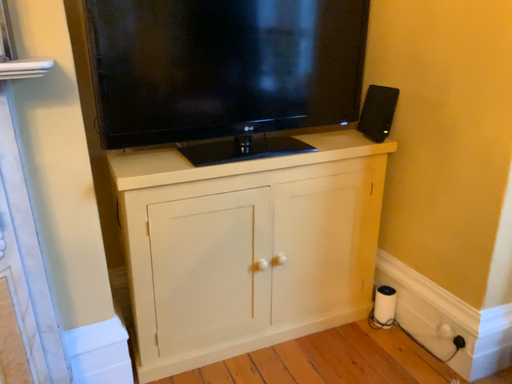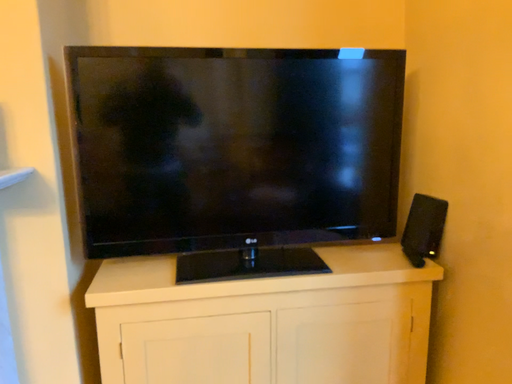
Question: How did the camera likely rotate when shooting the video?

Choices:
 (A) rotated upward
 (B) rotated downward

Answer: (A)